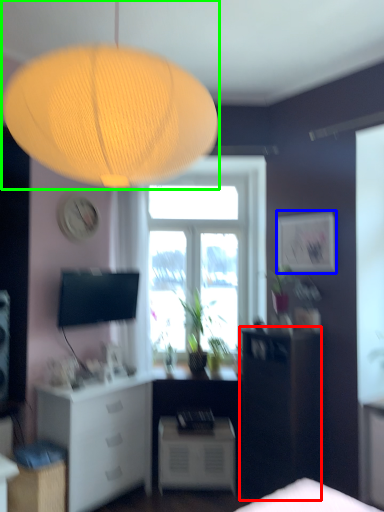
Question: Based on their relative distances, which object is nearer to furniture (highlighted by a red box)? Choose from picture frame (highlighted by a blue box) and lamp (highlighted by a green box).

Choices:
 (A) picture frame
 (B) lamp

Answer: (A)